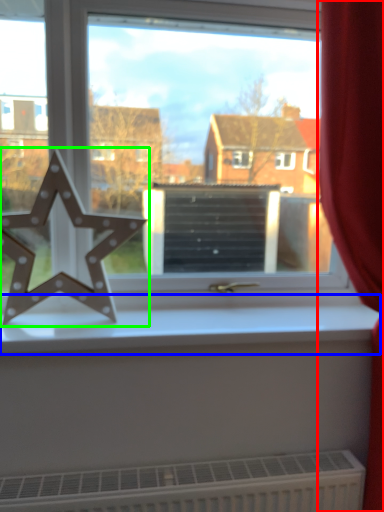
Question: Estimate the real-world distances between objects in this image. Which object is farther from curtain (highlighted by a red box), window sill (highlighted by a blue box) or letter (highlighted by a green box)?

Choices:
 (A) window sill
 (B) letter

Answer: (B)